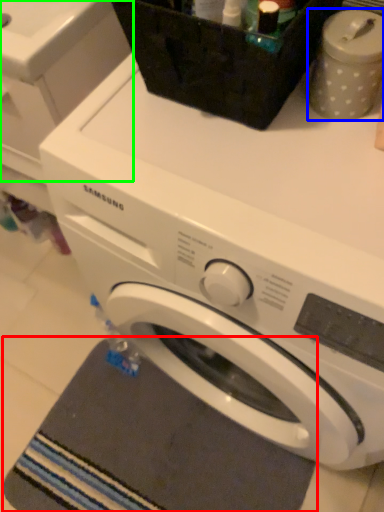
Question: Considering the real-world distances, which object is farthest from bath mat (highlighted by a red box)? appliance (highlighted by a blue box) or washing machine (highlighted by a green box)?

Choices:
 (A) appliance
 (B) washing machine

Answer: (A)